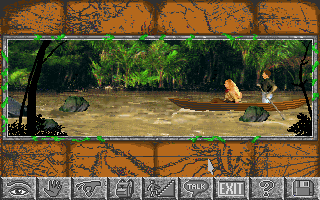
This screenshot has height=200, width=320. I want to click on picture border, so click(132, 139).